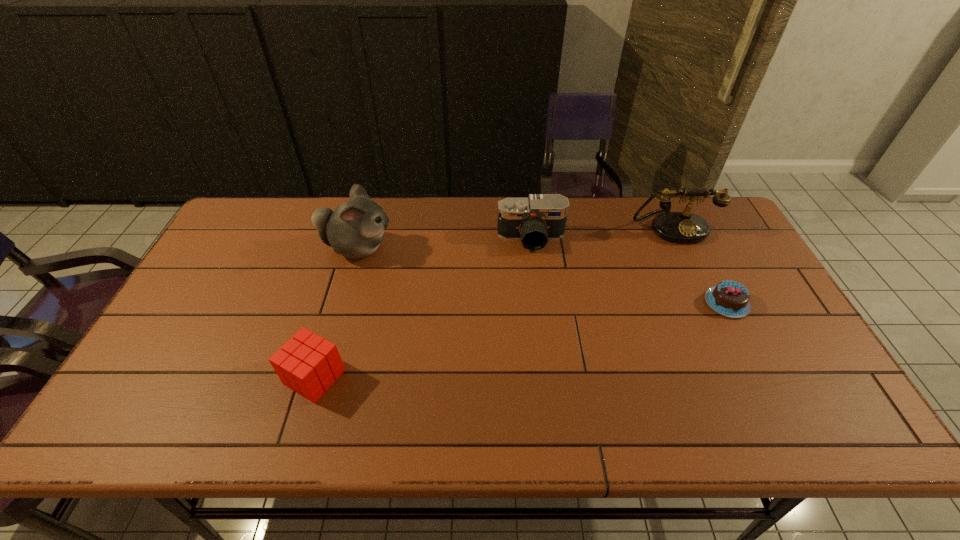
In order to click on vacant space at the near edge in this screenshot , I will do `click(343, 410)`.

Where is `vacant region at the left edge of the desktop`? Image resolution: width=960 pixels, height=540 pixels. vacant region at the left edge of the desktop is located at coordinates (181, 323).

This screenshot has height=540, width=960. In order to click on vacant region at the right edge in this screenshot , I will do `click(754, 296)`.

This screenshot has width=960, height=540. In the image, there is a desktop. What are the coordinates of `free space at the far left corner` in the screenshot? It's located at (282, 208).

This screenshot has width=960, height=540. What are the coordinates of `free space at the far right corner` in the screenshot? It's located at (699, 204).

Locate an element on the screen. free space between the shortest object and the third object from left to right is located at coordinates (629, 271).

Find the location of `free spot between the camera and the shortest object`. free spot between the camera and the shortest object is located at coordinates (629, 271).

Locate an element on the screen. vacant region between the cube and the shortest object is located at coordinates (520, 340).

The width and height of the screenshot is (960, 540). What are the coordinates of `free space between the third tallest object and the tallest object` in the screenshot? It's located at (444, 244).

The width and height of the screenshot is (960, 540). I want to click on empty space between the tallest object and the cube, so click(336, 313).